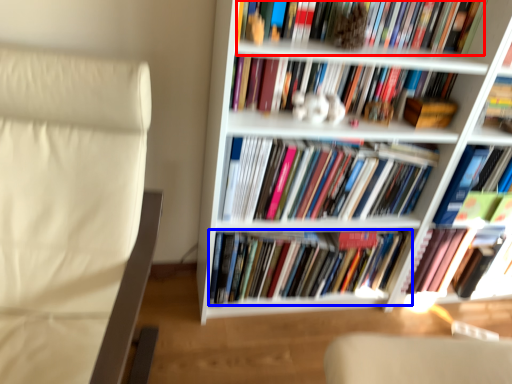
Question: Which point is closer to the camera, book (highlighted by a red box) or book (highlighted by a blue box)?

Choices:
 (A) book
 (B) book

Answer: (A)